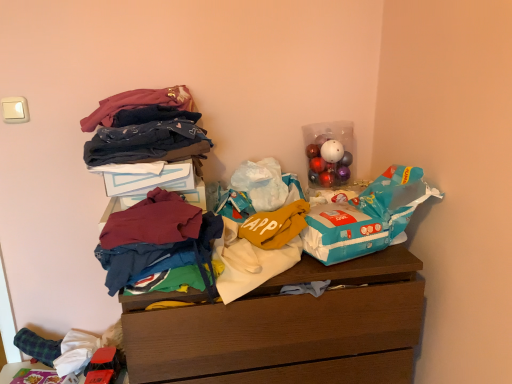
This screenshot has height=384, width=512. What do you see at coordinates (154, 236) in the screenshot? I see `maroon cotton t-shirt at center, the fourth clothing positioned from the top` at bounding box center [154, 236].

I want to click on wooden chest of drawers at center, so click(x=286, y=329).

At what (x,y) coordinates should I click in order to perform the action: click on blue plastic grocery bag at upper right. Please return your answer as a coordinate pair (x, y). This screenshot has height=384, width=512. Looking at the image, I should click on (366, 217).

Is wooden chest of drawers at center facing towards blue cotton blanket at upper left, which appears as the 2th clothing when viewed from the top?

No, wooden chest of drawers at center is not turned towards blue cotton blanket at upper left, which appears as the 2th clothing when viewed from the top.

Is wooden chest of drawers at center not inside blue cotton blanket at upper left, which appears as the 2th clothing when viewed from the top?

Yes, wooden chest of drawers at center is located beyond the bounds of blue cotton blanket at upper left, which appears as the 2th clothing when viewed from the top.

From the image's perspective, relative to blue cotton blanket at upper left, which appears as the third clothing when ordered from the bottom, is wooden chest of drawers at center above or below?

Based on their image positions, wooden chest of drawers at center is located beneath blue cotton blanket at upper left, which appears as the third clothing when ordered from the bottom.

Is the surface of wooden chest of drawers at center in direct contact with blue cotton blanket at upper left, which appears as the 2th clothing when viewed from the top?

There is a gap between wooden chest of drawers at center and blue cotton blanket at upper left, which appears as the 2th clothing when viewed from the top.

Is maroon cotton t-shirt at center, arranged as the 1th clothing when ordered from the bottom, touching wooden chest of drawers at center?

No, maroon cotton t-shirt at center, arranged as the 1th clothing when ordered from the bottom, is not touching wooden chest of drawers at center.

Which is closer to the camera, (125, 279) or (351, 345)?

Point (125, 279) appears to be closer to the viewer than point (351, 345).

From a real-world perspective, relative to wooden chest of drawers at center, is maroon cotton t-shirt at center, arranged as the 1th clothing when ordered from the bottom, vertically above or below?

maroon cotton t-shirt at center, arranged as the 1th clothing when ordered from the bottom, is above wooden chest of drawers at center.

Where is `chest of drawers behind the maroon cotton t-shirt at center, arranged as the 1th clothing when ordered from the bottom`? This screenshot has width=512, height=384. chest of drawers behind the maroon cotton t-shirt at center, arranged as the 1th clothing when ordered from the bottom is located at coordinates (286, 329).

Between velvet-like fabric at upper left, positioned as the first clothing in top-to-bottom order, and blue plastic grocery bag at upper right, which one has smaller width?

With smaller width is blue plastic grocery bag at upper right.

Can you confirm if velvet-like fabric at upper left, the fourth clothing ordered from the bottom, is shorter than blue plastic grocery bag at upper right?

Indeed, velvet-like fabric at upper left, the fourth clothing ordered from the bottom, has a lesser height compared to blue plastic grocery bag at upper right.

From the image's perspective, is velvet-like fabric at upper left, positioned as the first clothing in top-to-bottom order, over blue plastic grocery bag at upper right?

Indeed, from the image's perspective, velvet-like fabric at upper left, positioned as the first clothing in top-to-bottom order, is shown above blue plastic grocery bag at upper right.

Which is behind, point (114, 119) or point (359, 198)?

Point (359, 198)

Based on the photo, which object is closer to the camera, shiny plastic ornaments at upper right or maroon cotton t-shirt at center, arranged as the 1th clothing when ordered from the bottom?

Positioned in front is maroon cotton t-shirt at center, arranged as the 1th clothing when ordered from the bottom.

Is maroon cotton t-shirt at center, arranged as the 1th clothing when ordered from the bottom, located within shiny plastic ornaments at upper right?

No, maroon cotton t-shirt at center, arranged as the 1th clothing when ordered from the bottom, is not surrounded by shiny plastic ornaments at upper right.

Is shiny plastic ornaments at upper right smaller than maroon cotton t-shirt at center, the fourth clothing positioned from the top?

Yes, shiny plastic ornaments at upper right is smaller than maroon cotton t-shirt at center, the fourth clothing positioned from the top.

How much distance is there between shiny plastic ornaments at upper right and maroon cotton t-shirt at center, arranged as the 1th clothing when ordered from the bottom?

shiny plastic ornaments at upper right and maroon cotton t-shirt at center, arranged as the 1th clothing when ordered from the bottom, are 24.07 inches apart from each other.

Is blue plastic grocery bag at upper right far away from maroon cotton t-shirt at center, the fourth clothing positioned from the top?

Actually, blue plastic grocery bag at upper right and maroon cotton t-shirt at center, the fourth clothing positioned from the top, are a little close together.

From a real-world perspective, which is physically below, blue plastic grocery bag at upper right or maroon cotton t-shirt at center, arranged as the 1th clothing when ordered from the bottom?

In real-world perspective, maroon cotton t-shirt at center, arranged as the 1th clothing when ordered from the bottom, is lower.

Which of these two, blue plastic grocery bag at upper right or maroon cotton t-shirt at center, arranged as the 1th clothing when ordered from the bottom, is thinner?

maroon cotton t-shirt at center, arranged as the 1th clothing when ordered from the bottom, is thinner.

Consider the image. Is blue cotton blanket at upper left, which appears as the third clothing when ordered from the bottom, oriented away from blue plastic grocery bag at upper right?

No, blue cotton blanket at upper left, which appears as the third clothing when ordered from the bottom, is not facing the opposite direction of blue plastic grocery bag at upper right.

Who is more distant, blue cotton blanket at upper left, which appears as the 2th clothing when viewed from the top, or blue plastic grocery bag at upper right?

Positioned behind is blue cotton blanket at upper left, which appears as the 2th clothing when viewed from the top.

Is blue cotton blanket at upper left, which appears as the 2th clothing when viewed from the top, far away from blue plastic grocery bag at upper right?

blue cotton blanket at upper left, which appears as the 2th clothing when viewed from the top, is near blue plastic grocery bag at upper right, not far away.

Considering the sizes of maroon fabric shirt at center, marked as the 2th clothing in a bottom-to-top arrangement, and shiny plastic ornaments at upper right in the image, is maroon fabric shirt at center, marked as the 2th clothing in a bottom-to-top arrangement, wider or thinner than shiny plastic ornaments at upper right?

maroon fabric shirt at center, marked as the 2th clothing in a bottom-to-top arrangement, is thinner than shiny plastic ornaments at upper right.

Looking at the image, does maroon fabric shirt at center, the third clothing from the top, seem bigger or smaller compared to shiny plastic ornaments at upper right?

Considering their sizes, maroon fabric shirt at center, the third clothing from the top, takes up less space than shiny plastic ornaments at upper right.

In the scene shown: From a real-world perspective, which is physically below, maroon fabric shirt at center, marked as the 2th clothing in a bottom-to-top arrangement, or shiny plastic ornaments at upper right?

maroon fabric shirt at center, marked as the 2th clothing in a bottom-to-top arrangement.

Does point (181, 209) come behind point (327, 172)?

No, it is in front of (327, 172).

In order to click on clothing that is the 3rd one above the wooden chest of drawers at center (from a real-world perspective) in this screenshot , I will do `click(145, 142)`.

Find the location of a particular element. This screenshot has width=512, height=384. the 2nd clothing in front when counting from the wooden chest of drawers at center is located at coordinates (154, 236).

Estimate the real-world distances between objects in this image. Which object is further from maroon fabric shirt at center, the third clothing from the top, wooden chest of drawers at center or blue cotton blanket at upper left, which appears as the third clothing when ordered from the bottom?

wooden chest of drawers at center is positioned further to the anchor maroon fabric shirt at center, the third clothing from the top.

Considering their positions, is shiny plastic ornaments at upper right positioned closer to blue plastic grocery bag at upper right than wooden chest of drawers at center?

The object closer to blue plastic grocery bag at upper right is wooden chest of drawers at center.

Estimate the real-world distances between objects in this image. Which object is further from maroon cotton t-shirt at center, the fourth clothing positioned from the top, velvet-like fabric at upper left, positioned as the first clothing in top-to-bottom order, or wooden chest of drawers at center?

velvet-like fabric at upper left, positioned as the first clothing in top-to-bottom order, lies further to maroon cotton t-shirt at center, the fourth clothing positioned from the top, than the other object.

Based on their spatial positions, is blue plastic grocery bag at upper right or velvet-like fabric at upper left, positioned as the first clothing in top-to-bottom order, further from wooden chest of drawers at center?

The object further to wooden chest of drawers at center is velvet-like fabric at upper left, positioned as the first clothing in top-to-bottom order.

Estimate the real-world distances between objects in this image. Which object is further from maroon fabric shirt at center, the third clothing from the top, blue plastic grocery bag at upper right or maroon cotton t-shirt at center, arranged as the 1th clothing when ordered from the bottom?

blue plastic grocery bag at upper right lies further to maroon fabric shirt at center, the third clothing from the top, than the other object.

Estimate the real-world distances between objects in this image. Which object is closer to maroon fabric shirt at center, marked as the 2th clothing in a bottom-to-top arrangement, shiny plastic ornaments at upper right or blue plastic grocery bag at upper right?

blue plastic grocery bag at upper right.

From the picture: Based on their spatial positions, is wooden chest of drawers at center or maroon cotton t-shirt at center, the fourth clothing positioned from the top, closer to blue cotton blanket at upper left, which appears as the third clothing when ordered from the bottom?

The object closer to blue cotton blanket at upper left, which appears as the third clothing when ordered from the bottom, is maroon cotton t-shirt at center, the fourth clothing positioned from the top.

Which object lies nearer to the anchor point maroon cotton t-shirt at center, arranged as the 1th clothing when ordered from the bottom, shiny plastic ornaments at upper right or wooden chest of drawers at center?

Among the two, wooden chest of drawers at center is located nearer to maroon cotton t-shirt at center, arranged as the 1th clothing when ordered from the bottom.

Image resolution: width=512 pixels, height=384 pixels. I want to click on toy between velvet-like fabric at upper left, the fourth clothing ordered from the bottom, and blue plastic grocery bag at upper right, in the horizontal direction, so click(x=328, y=163).

The height and width of the screenshot is (384, 512). Identify the location of toy located between blue cotton blanket at upper left, which appears as the 2th clothing when viewed from the top, and blue plastic grocery bag at upper right in the left-right direction. (328, 163).

Find the location of a particular element. toy between maroon cotton t-shirt at center, the fourth clothing positioned from the top, and blue plastic grocery bag at upper right, in the horizontal direction is located at coordinates (328, 163).

Where is `clothing between blue cotton blanket at upper left, which appears as the 2th clothing when viewed from the top, and maroon cotton t-shirt at center, arranged as the 1th clothing when ordered from the bottom, in the vertical direction`? clothing between blue cotton blanket at upper left, which appears as the 2th clothing when viewed from the top, and maroon cotton t-shirt at center, arranged as the 1th clothing when ordered from the bottom, in the vertical direction is located at coordinates click(x=153, y=221).